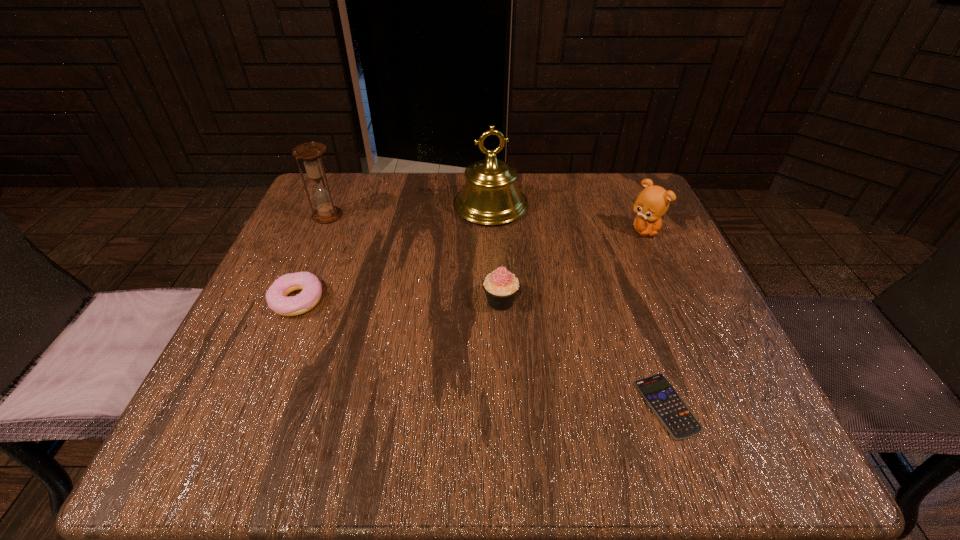
Locate an element on the screen. the third closest object relative to the bell is located at coordinates (310, 153).

Where is `free location that satisfies the following two spatial constraints: 1. on the back side of the bell; 2. on the left side of the hourglass`? free location that satisfies the following two spatial constraints: 1. on the back side of the bell; 2. on the left side of the hourglass is located at coordinates (331, 206).

Identify the location of free location that satisfies the following two spatial constraints: 1. on the front side of the doughnut; 2. on the right side of the cupcake. The height and width of the screenshot is (540, 960). (297, 301).